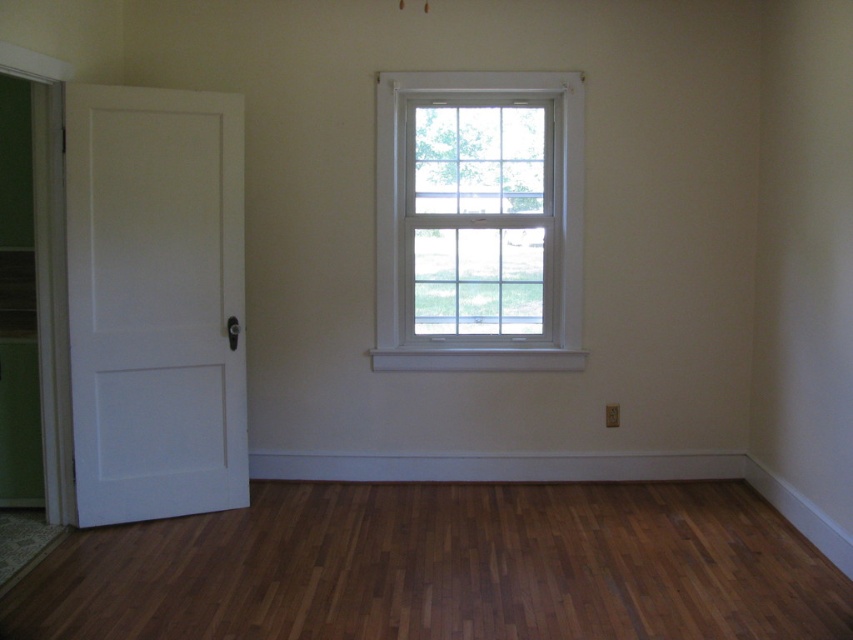
Which is behind, point (746, 604) or point (137, 346)?

The point (137, 346) is behind.

Is point (767, 582) positioned in front of point (236, 131)?

Yes, point (767, 582) is closer to viewer.

Find the location of `shiny brown hardwood floor at lower center`. shiny brown hardwood floor at lower center is located at coordinates (444, 568).

Is white matte door at left smaller than white wood window at center?

Indeed, white matte door at left has a smaller size compared to white wood window at center.

Can you confirm if white matte door at left is thinner than white wood window at center?

Indeed, white matte door at left has a lesser width compared to white wood window at center.

Between point (74, 224) and point (428, 80), which one is positioned in front?

Positioned in front is point (74, 224).

Where is `white matte door at left`? The height and width of the screenshot is (640, 853). white matte door at left is located at coordinates (155, 301).

Can you confirm if shiny brown hardwood floor at lower center is positioned above white wood window at center?

No, shiny brown hardwood floor at lower center is not above white wood window at center.

Does shiny brown hardwood floor at lower center have a lesser width compared to white wood window at center?

No.

I want to click on shiny brown hardwood floor at lower center, so click(x=444, y=568).

Find the location of a particular element. shiny brown hardwood floor at lower center is located at coordinates (444, 568).